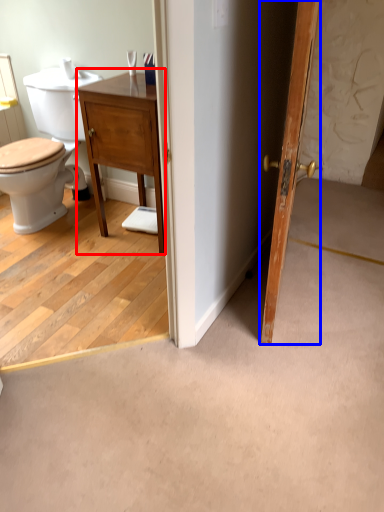
Question: Which object appears closest to the camera in this image, vanity (highlighted by a red box) or door (highlighted by a blue box)?

Choices:
 (A) vanity
 (B) door

Answer: (B)